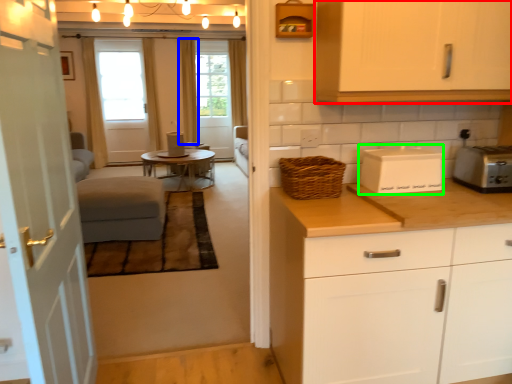
Question: Considering the real-world distances, which object is closest to cabinetry (highlighted by a red box)? curtain (highlighted by a blue box) or appliance (highlighted by a green box).

Choices:
 (A) curtain
 (B) appliance

Answer: (B)